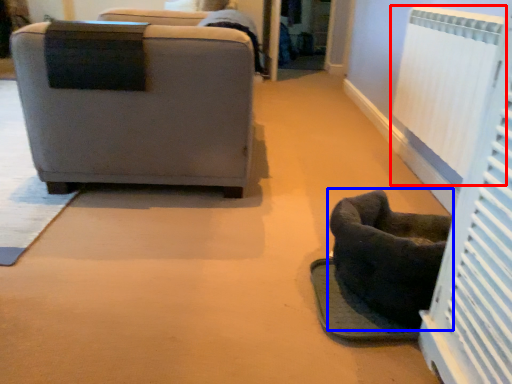
Question: Among these objects, which one is farthest to the camera, radiator (highlighted by a red box) or furniture (highlighted by a blue box)?

Choices:
 (A) radiator
 (B) furniture

Answer: (A)